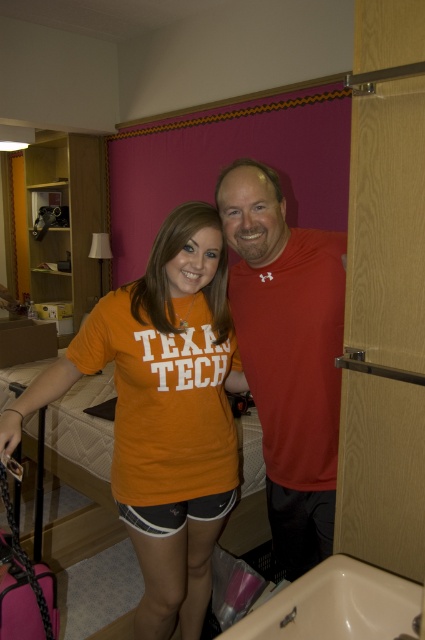
You are standing at point (312, 289) in the dorm room. There is another point at (121, 392). Which direction would you face to look towards the point behind you?

You should face towards the point (121, 392) because it is behind point (312, 289).